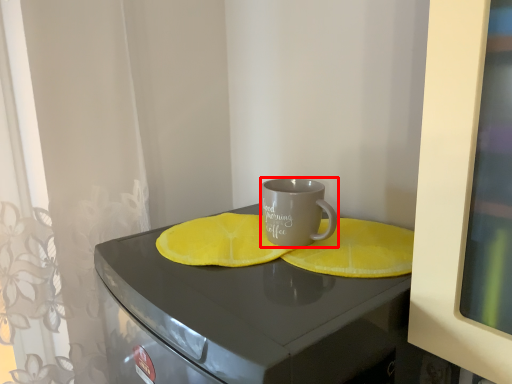
Question: Observing the image, what is the correct spatial positioning of coffee cup (annotated by the red box) in reference to table?

Choices:
 (A) right
 (B) left

Answer: (A)